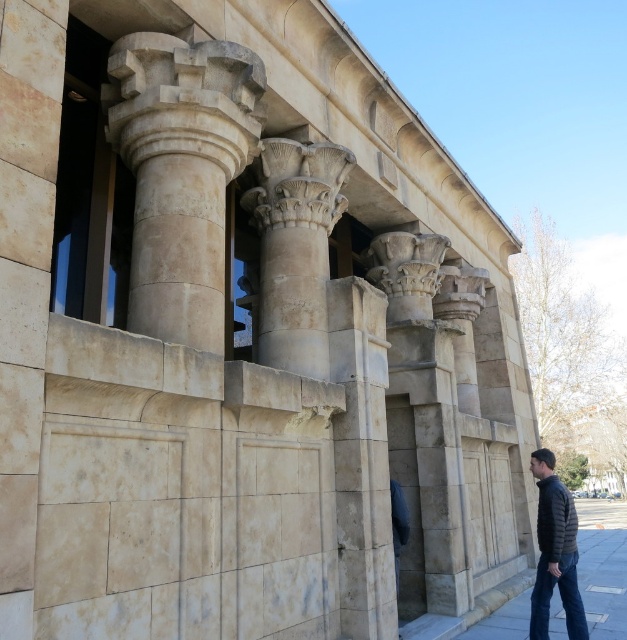
Is the position of white stone column at center less distant than that of denim jeans at lower right?

No, it is not.

Does point (303, 227) lie in front of point (566, 604)?

That is False.

Is point (310, 204) less distant than point (549, 584)?

No, (310, 204) is behind (549, 584).

Locate an element on the screen. Image resolution: width=627 pixels, height=640 pixels. white stone column at center is located at coordinates (295, 248).

Is point (159, 285) more distant than point (549, 508)?

No.

Can you confirm if beige stone column at center is taller than dark gray quilted jacket at lower right?

Yes.

This screenshot has height=640, width=627. Describe the element at coordinates (181, 173) in the screenshot. I see `beige stone column at center` at that location.

In order to click on beige stone column at center in this screenshot , I will do `click(181, 173)`.

How distant is beige stone column at center from white stone column at center?

beige stone column at center is 1.23 meters away from white stone column at center.

Does point (213, 96) lie in front of point (319, 221)?

Yes.

This screenshot has height=640, width=627. Identify the location of beige stone column at center. (181, 173).